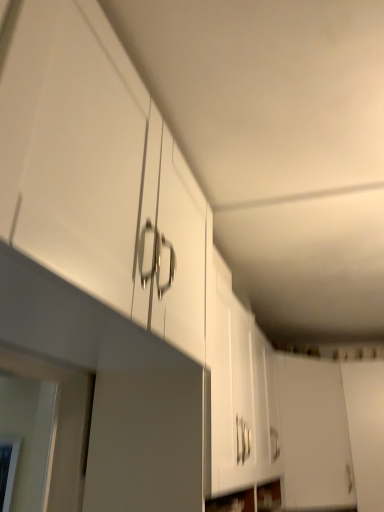
I want to click on white matte cabinet door at lower right, positioned as the 2th door in right-to-left order, so click(x=314, y=435).

You are a GUI agent. You are given a task and a screenshot of the screen. Output one action in this format:
    pyautogui.click(x=<x>, y=<y>)
    Task: Click on the white glossy cabinet at upper left
    
    Given the screenshot: What is the action you would take?
    pyautogui.click(x=97, y=170)

The height and width of the screenshot is (512, 384). What do you see at coordinates (97, 170) in the screenshot? I see `white glossy cabinet at upper left` at bounding box center [97, 170].

The image size is (384, 512). I want to click on white matte door at lower right, acting as the 2th door starting from the left, so click(366, 430).

Could you tell me if white matte door at lower right, arranged as the first door when viewed from the right, is turned towards white glossy cabinet at upper left?

Yes.

Considering the sizes of objects white matte door at lower right, arranged as the first door when viewed from the right, and white glossy cabinet at upper left in the image provided, who is wider, white matte door at lower right, arranged as the first door when viewed from the right, or white glossy cabinet at upper left?

white glossy cabinet at upper left.

Does white matte door at lower right, acting as the 2th door starting from the left, contain white glossy cabinet at upper left?

No, white glossy cabinet at upper left is not inside white matte door at lower right, acting as the 2th door starting from the left.

Is white matte door at lower right, acting as the 2th door starting from the left, positioned in front of white glossy cabinet at upper left?

No, the depth of white matte door at lower right, acting as the 2th door starting from the left, is greater than that of white glossy cabinet at upper left.

Where is `the 1st door counting from the right side of the white glossy cabinet at upper left`? the 1st door counting from the right side of the white glossy cabinet at upper left is located at coordinates (314, 435).

Consider the image. Which is correct: white glossy cabinet at upper left is inside white matte cabinet door at lower right, the first door positioned from the left, or outside of it?

white glossy cabinet at upper left is spatially situated outside white matte cabinet door at lower right, the first door positioned from the left.

In the scene shown: From a real-world perspective, which object stands above the other?

white glossy cabinet at upper left, from a real-world perspective.

Is point (169, 192) positioned in front of point (295, 466)?

That is True.

Is there a large distance between white glossy cabinet at upper left and white matte door at lower right, arranged as the first door when viewed from the right?

Yes, white glossy cabinet at upper left is far from white matte door at lower right, arranged as the first door when viewed from the right.

From the image's perspective, starting from the white glossy cabinet at upper left, which door is the 2nd one below? Please provide its 2D coordinates.

[(366, 430)]

In the image, is white glossy cabinet at upper left on the left side or the right side of white matte door at lower right, acting as the 2th door starting from the left?

white glossy cabinet at upper left is to the left of white matte door at lower right, acting as the 2th door starting from the left.

Does point (378, 373) appear closer or farther from the camera than point (345, 433)?

Clearly, point (378, 373) is more distant from the camera than point (345, 433).

Is white matte door at lower right, acting as the 2th door starting from the left, positioned far away from white matte cabinet door at lower right, the first door positioned from the left?

No, white matte door at lower right, acting as the 2th door starting from the left, is in close proximity to white matte cabinet door at lower right, the first door positioned from the left.

You are a GUI agent. You are given a task and a screenshot of the screen. Output one action in this format:
    pyautogui.click(x=<x>, y=<y>)
    Task: Click on the door located in front of the white matte door at lower right, acting as the 2th door starting from the left
    The width and height of the screenshot is (384, 512).
    Given the screenshot: What is the action you would take?
    pyautogui.click(x=314, y=435)

Between white matte door at lower right, arranged as the first door when viewed from the right, and white matte cabinet door at lower right, positioned as the 2th door in right-to-left order, which one has more height?

A: white matte door at lower right, arranged as the first door when viewed from the right.

Is the depth of white matte cabinet door at lower right, positioned as the 2th door in right-to-left order, greater than that of white glossy cabinet at upper left?

Yes.

From the image's perspective, between white matte cabinet door at lower right, positioned as the 2th door in right-to-left order, and white glossy cabinet at upper left, who is located below?

white matte cabinet door at lower right, positioned as the 2th door in right-to-left order, is shown below in the image.

Could you tell me if white matte cabinet door at lower right, positioned as the 2th door in right-to-left order, is turned towards white glossy cabinet at upper left?

No.

From the image's perspective, which is below, white matte cabinet door at lower right, the first door positioned from the left, or white matte door at lower right, arranged as the first door when viewed from the right?

white matte door at lower right, arranged as the first door when viewed from the right, from the image's perspective.

Does white matte cabinet door at lower right, positioned as the 2th door in right-to-left order, touch white matte door at lower right, arranged as the first door when viewed from the right?

No, white matte cabinet door at lower right, positioned as the 2th door in right-to-left order, is not with white matte door at lower right, arranged as the first door when viewed from the right.

Is white matte cabinet door at lower right, the first door positioned from the left, to the left of white matte door at lower right, arranged as the first door when viewed from the right, from the viewer's perspective?

Yes, white matte cabinet door at lower right, the first door positioned from the left, is to the left of white matte door at lower right, arranged as the first door when viewed from the right.

Between point (337, 405) and point (353, 447), which one is positioned in front?

Positioned in front is point (353, 447).

Find the location of a particular element. The height and width of the screenshot is (512, 384). cabinetry above the white matte door at lower right, acting as the 2th door starting from the left (from the image's perspective) is located at coordinates (97, 170).

Identify the location of door that is the 1st object located below the white glossy cabinet at upper left (from the image's perspective). (314, 435).

Which object lies nearer to the anchor point white matte door at lower right, acting as the 2th door starting from the left, white matte cabinet door at lower right, the first door positioned from the left, or white glossy cabinet at upper left?

white matte cabinet door at lower right, the first door positioned from the left, is positioned closer to the anchor white matte door at lower right, acting as the 2th door starting from the left.

Based on their spatial positions, is white matte door at lower right, acting as the 2th door starting from the left, or white matte cabinet door at lower right, the first door positioned from the left, closer to white glossy cabinet at upper left?

The object closer to white glossy cabinet at upper left is white matte cabinet door at lower right, the first door positioned from the left.

Based on their spatial positions, is white matte cabinet door at lower right, positioned as the 2th door in right-to-left order, or white matte door at lower right, acting as the 2th door starting from the left, closer to white glossy cabinet at upper left?

Among the two, white matte cabinet door at lower right, positioned as the 2th door in right-to-left order, is located nearer to white glossy cabinet at upper left.

Estimate the real-world distances between objects in this image. Which object is closer to white matte cabinet door at lower right, positioned as the 2th door in right-to-left order, white glossy cabinet at upper left or white matte door at lower right, arranged as the first door when viewed from the right?

Among the two, white matte door at lower right, arranged as the first door when viewed from the right, is located nearer to white matte cabinet door at lower right, positioned as the 2th door in right-to-left order.

When comparing their distances from white matte cabinet door at lower right, the first door positioned from the left, does white matte door at lower right, acting as the 2th door starting from the left, or white glossy cabinet at upper left seem closer?

Based on the image, white matte door at lower right, acting as the 2th door starting from the left, appears to be nearer to white matte cabinet door at lower right, the first door positioned from the left.

Looking at the image, which one is located closer to white matte door at lower right, acting as the 2th door starting from the left, white glossy cabinet at upper left or white matte cabinet door at lower right, positioned as the 2th door in right-to-left order?

The object closer to white matte door at lower right, acting as the 2th door starting from the left, is white matte cabinet door at lower right, positioned as the 2th door in right-to-left order.

You are a GUI agent. You are given a task and a screenshot of the screen. Output one action in this format:
    pyautogui.click(x=<x>, y=<y>)
    Task: Click on the door between white glossy cabinet at upper left and white matte door at lower right, arranged as the first door when viewed from the right, from front to back
    The height and width of the screenshot is (512, 384).
    Given the screenshot: What is the action you would take?
    pyautogui.click(x=314, y=435)